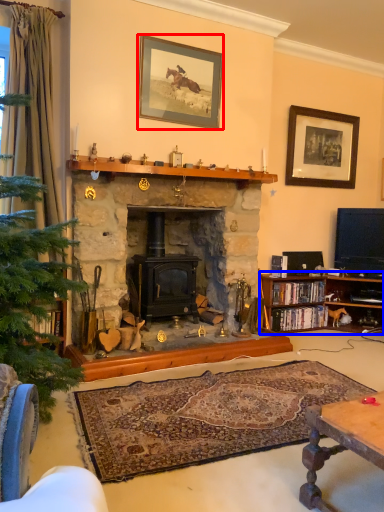
Question: Which object is closer to the camera taking this photo, picture frame (highlighted by a red box) or cabinetry (highlighted by a blue box)?

Choices:
 (A) picture frame
 (B) cabinetry

Answer: (A)